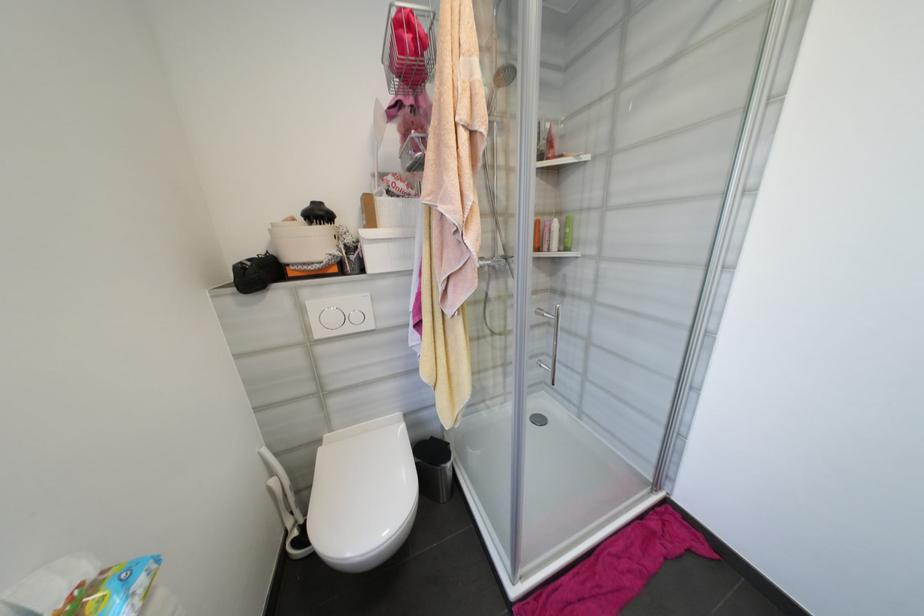
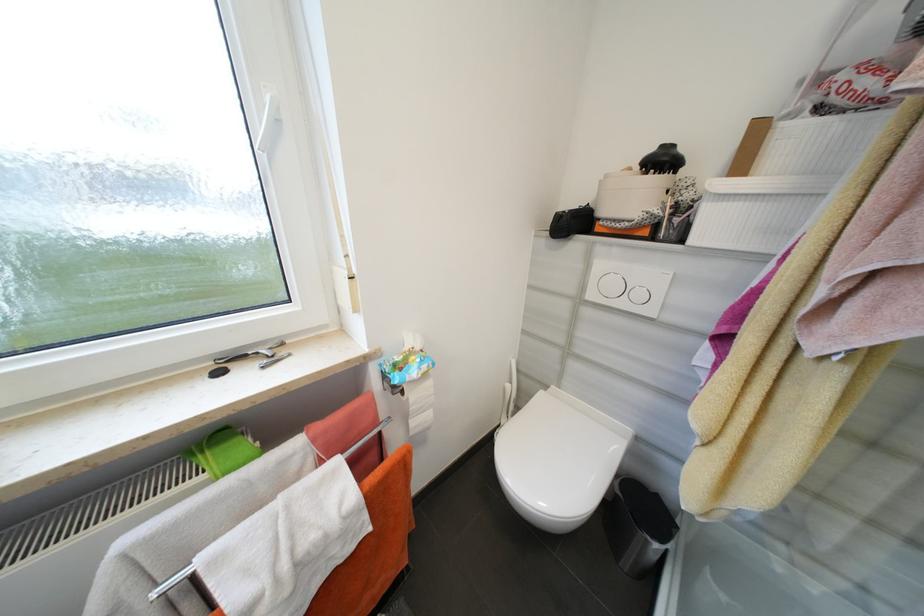
The point at (325, 443) is marked in the first image. Where is the corresponding point in the second image?

(552, 387)